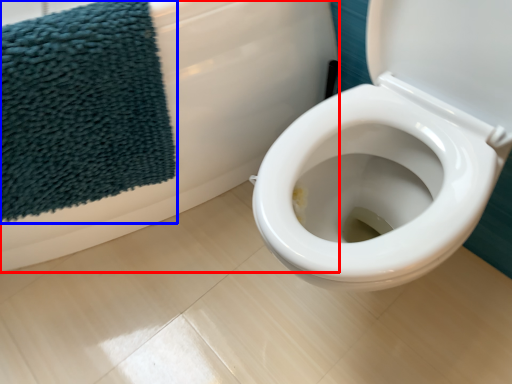
Question: Among these objects, which one is farthest to the camera, bath (highlighted by a red box) or beach towel (highlighted by a blue box)?

Choices:
 (A) bath
 (B) beach towel

Answer: (B)